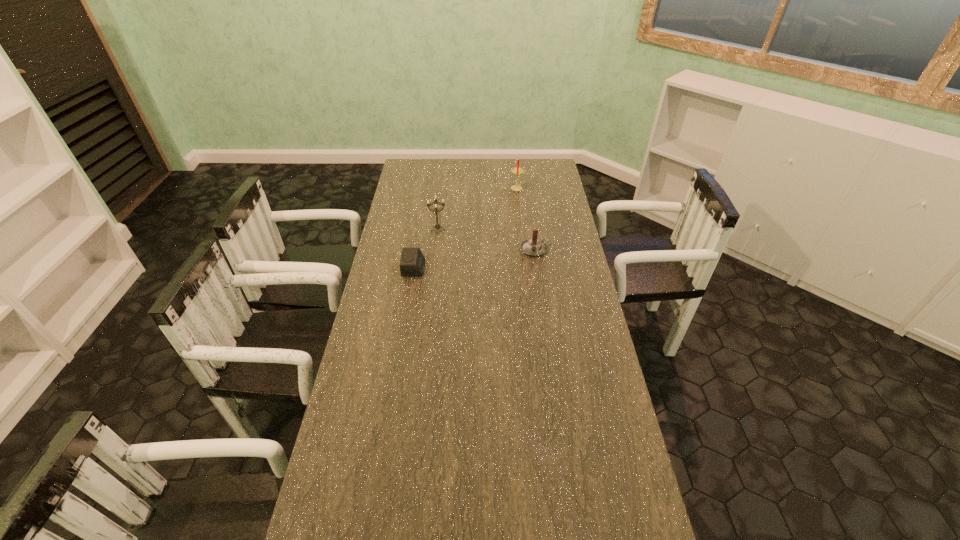
Find the location of a particular element. free area in between the shortest object and the farther candle is located at coordinates (466, 228).

This screenshot has height=540, width=960. What are the coordinates of `vacant point located between the alarm clock and the third nearest object` in the screenshot? It's located at (426, 249).

Identify the location of vacant area that lies between the farthest object and the nearest object. The image size is (960, 540). (466, 228).

Identify the location of free spot between the second farthest object and the taller candle. This screenshot has width=960, height=540. (478, 210).

Locate an element on the screen. This screenshot has height=540, width=960. free space between the candle holder and the taller candle is located at coordinates click(x=478, y=210).

The image size is (960, 540). I want to click on vacant space that is in between the farthest object and the third tallest object, so click(x=527, y=219).

Identify the location of free space that is in between the third farthest object and the farthest object. (527, 219).

Identify which object is located as the third nearest to the farthest object. Please provide its 2D coordinates. Your answer should be formatted as a tuple, i.e. [(x, y)], where the tuple contains the x and y coordinates of a point satisfying the conditions above.

[(412, 263)]

Locate an element on the screen. the closest object relative to the taller candle is located at coordinates (533, 247).

This screenshot has height=540, width=960. Find the location of `free spot that satisfies the following two spatial constraints: 1. on the front side of the farther candle; 2. on the front-facing side of the shortest object`. free spot that satisfies the following two spatial constraints: 1. on the front side of the farther candle; 2. on the front-facing side of the shortest object is located at coordinates (528, 268).